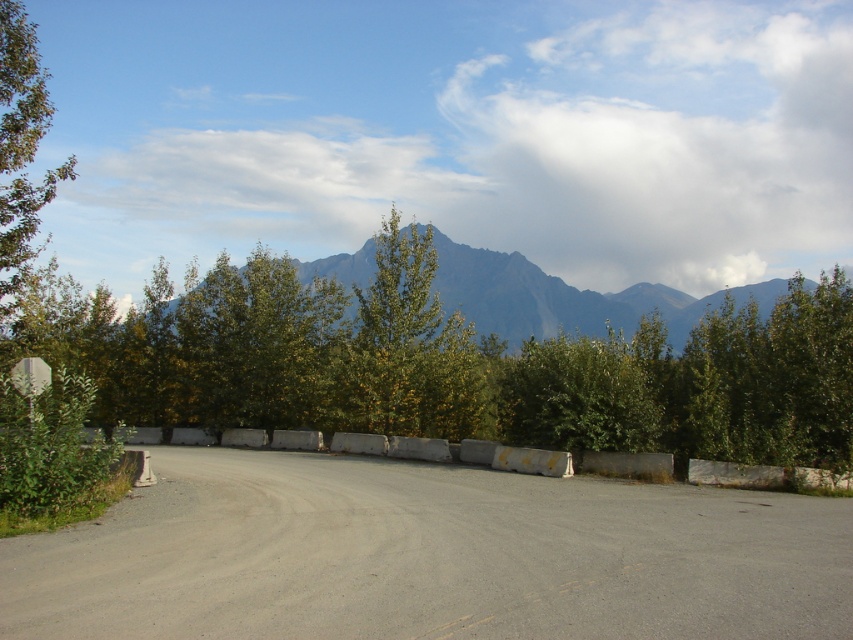
You are a hiker standing at the point marked by point (x=428, y=556) on the gray asphalt dirt track at center. You want to walk towards the dense line of trees in the background. Which direction should you head relative to the gray asphalt dirt track at center?

The gray asphalt dirt track at center is represented by point (x=428, y=556). To walk towards the dense line of trees in the background, you should head north along the gray asphalt dirt track at center since the trees are located in the background direction.

You are standing at point [448,364] in the image. What object is directly in front of you?

The green leafy tree at center is directly in front of you at point [448,364].